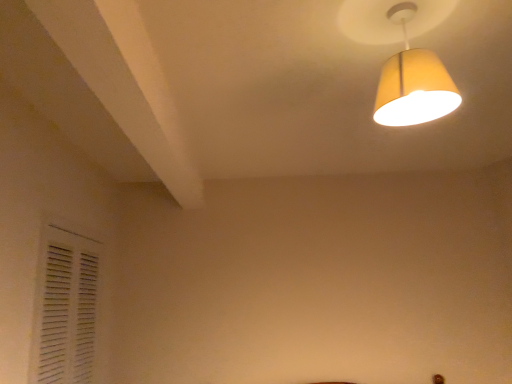
Locate an element on the screen. Image resolution: width=512 pixels, height=384 pixels. yellow fabric lampshade at upper right is located at coordinates (413, 81).

What do you see at coordinates (413, 81) in the screenshot? I see `yellow fabric lampshade at upper right` at bounding box center [413, 81].

At what (x,y) coordinates should I click in order to perform the action: click on white matte shutter at lower left. Please return your answer as a coordinate pair (x, y). This screenshot has width=512, height=384. Looking at the image, I should click on (65, 307).

What is the approximate width of white matte shutter at lower left?

white matte shutter at lower left is 2.27 inches in width.

What is the approximate height of white matte shutter at lower left?

white matte shutter at lower left is 36.35 inches tall.

Measure the distance between point (66, 323) and camera.

The depth of point (66, 323) is 6.94 feet.

What do you see at coordinates (65, 307) in the screenshot? I see `white matte shutter at lower left` at bounding box center [65, 307].

You are a GUI agent. You are given a task and a screenshot of the screen. Output one action in this format:
    pyautogui.click(x=<x>, y=<y>)
    Task: Click on the yellow fabric lampshade at upper right
    The width and height of the screenshot is (512, 384).
    Given the screenshot: What is the action you would take?
    pyautogui.click(x=413, y=81)

Which object is positioned more to the right, yellow fabric lampshade at upper right or white matte shutter at lower left?

yellow fabric lampshade at upper right.

Is yellow fabric lampshade at upper right closer to camera compared to white matte shutter at lower left?

Yes, yellow fabric lampshade at upper right is in front of white matte shutter at lower left.

Is point (380, 105) closer to camera compared to point (94, 284)?

Yes, it is.

From the image's perspective, relative to white matte shutter at lower left, is yellow fabric lampshade at upper right above or below?

Clearly, from the image's perspective, yellow fabric lampshade at upper right is above white matte shutter at lower left.

From a real-world perspective, is yellow fabric lampshade at upper right physically above white matte shutter at lower left?

Yes, from a real-world perspective, yellow fabric lampshade at upper right is over white matte shutter at lower left

Is yellow fabric lampshade at upper right wider than white matte shutter at lower left?

Yes.

Between yellow fabric lampshade at upper right and white matte shutter at lower left, which one has more height?

white matte shutter at lower left.

Does yellow fabric lampshade at upper right have a smaller size compared to white matte shutter at lower left?

Yes, yellow fabric lampshade at upper right is smaller than white matte shutter at lower left.

Is white matte shutter at lower left a part of yellow fabric lampshade at upper right?

No, white matte shutter at lower left is not inside yellow fabric lampshade at upper right.

Based on the photo, is yellow fabric lampshade at upper right in contact with white matte shutter at lower left?

No, yellow fabric lampshade at upper right is not next to white matte shutter at lower left.

Is yellow fabric lampshade at upper right facing away from white matte shutter at lower left?

No, yellow fabric lampshade at upper right's orientation is not away from white matte shutter at lower left.

Identify the location of lamp above the white matte shutter at lower left (from the image's perspective). This screenshot has height=384, width=512. (x=413, y=81).

Considering the positions of objects white matte shutter at lower left and yellow fabric lampshade at upper right in the image provided, who is more to the right, white matte shutter at lower left or yellow fabric lampshade at upper right?

yellow fabric lampshade at upper right.

Does white matte shutter at lower left lie in front of yellow fabric lampshade at upper right?

That is False.

Which is less distant, (56, 245) or (430, 90)?

Point (56, 245) is farther from the camera than point (430, 90).

From the image's perspective, is white matte shutter at lower left positioned above or below yellow fabric lampshade at upper right?

white matte shutter at lower left is below yellow fabric lampshade at upper right.

From a real-world perspective, is white matte shutter at lower left positioned under yellow fabric lampshade at upper right based on gravity?

Yes, from a real-world perspective, white matte shutter at lower left is beneath yellow fabric lampshade at upper right.

Which of these two, white matte shutter at lower left or yellow fabric lampshade at upper right, is thinner?

Thinner between the two is white matte shutter at lower left.

Considering the relative sizes of white matte shutter at lower left and yellow fabric lampshade at upper right in the image provided, is white matte shutter at lower left taller than yellow fabric lampshade at upper right?

Correct, white matte shutter at lower left is much taller as yellow fabric lampshade at upper right.

Does white matte shutter at lower left have a smaller size compared to yellow fabric lampshade at upper right?

Incorrect, white matte shutter at lower left is not smaller in size than yellow fabric lampshade at upper right.

Which is correct: white matte shutter at lower left is inside yellow fabric lampshade at upper right, or outside of it?

The correct answer is: outside.

Is white matte shutter at lower left placed right next to yellow fabric lampshade at upper right?

No, white matte shutter at lower left is not in contact with yellow fabric lampshade at upper right.

Is white matte shutter at lower left aimed at yellow fabric lampshade at upper right?

No, white matte shutter at lower left is not oriented towards yellow fabric lampshade at upper right.

Can you tell me how much white matte shutter at lower left and yellow fabric lampshade at upper right differ in facing direction?

There is a 0.881-degree angle between the facing directions of white matte shutter at lower left and yellow fabric lampshade at upper right.

How far apart are white matte shutter at lower left and yellow fabric lampshade at upper right?

white matte shutter at lower left is 1.70 meters from yellow fabric lampshade at upper right.

Locate an element on the screen. The image size is (512, 384). lamp in front of the white matte shutter at lower left is located at coordinates (413, 81).

At what (x,y) coordinates should I click in order to perform the action: click on lamp that appears above the white matte shutter at lower left (from the image's perspective). Please return your answer as a coordinate pair (x, y). This screenshot has height=384, width=512. Looking at the image, I should click on (413, 81).

Locate an element on the screen. lamp on the right of white matte shutter at lower left is located at coordinates point(413,81).